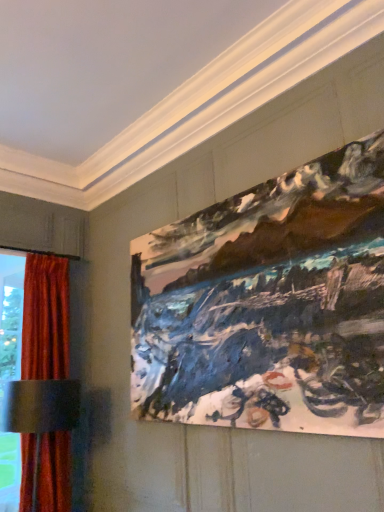
Question: Is velvet red curtain at left situated inside painted canvas at upper right or outside?

Choices:
 (A) inside
 (B) outside

Answer: (B)

Question: Is point (56, 309) closer or farther from the camera than point (153, 396)?

Choices:
 (A) farther
 (B) closer

Answer: (A)

Question: In the image, is velvet red curtain at left positioned in front of or behind painted canvas at upper right?

Choices:
 (A) behind
 (B) front

Answer: (A)

Question: Is point (380, 207) positioned closer to the camera than point (49, 275)?

Choices:
 (A) farther
 (B) closer

Answer: (B)

Question: From a real-world perspective, is painted canvas at upper right positioned above or below velvet red curtain at left?

Choices:
 (A) above
 (B) below

Answer: (A)

Question: Looking at their shapes, would you say painted canvas at upper right is wider or thinner than velvet red curtain at left?

Choices:
 (A) wide
 (B) thin

Answer: (B)

Question: In the image, is painted canvas at upper right positioned in front of or behind velvet red curtain at left?

Choices:
 (A) front
 (B) behind

Answer: (A)